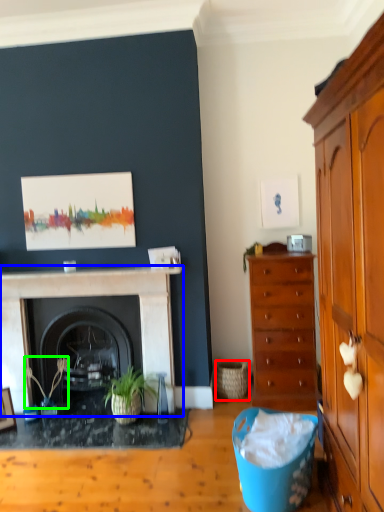
Question: Which is farther away from basket (highlighted by a red box)? fireplace (highlighted by a blue box) or plant (highlighted by a green box)?

Choices:
 (A) fireplace
 (B) plant

Answer: (B)